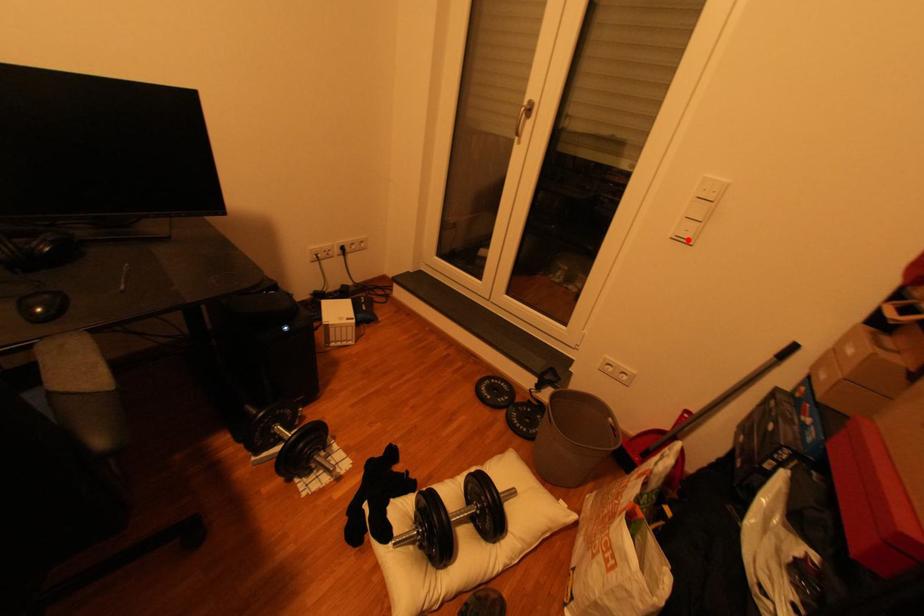
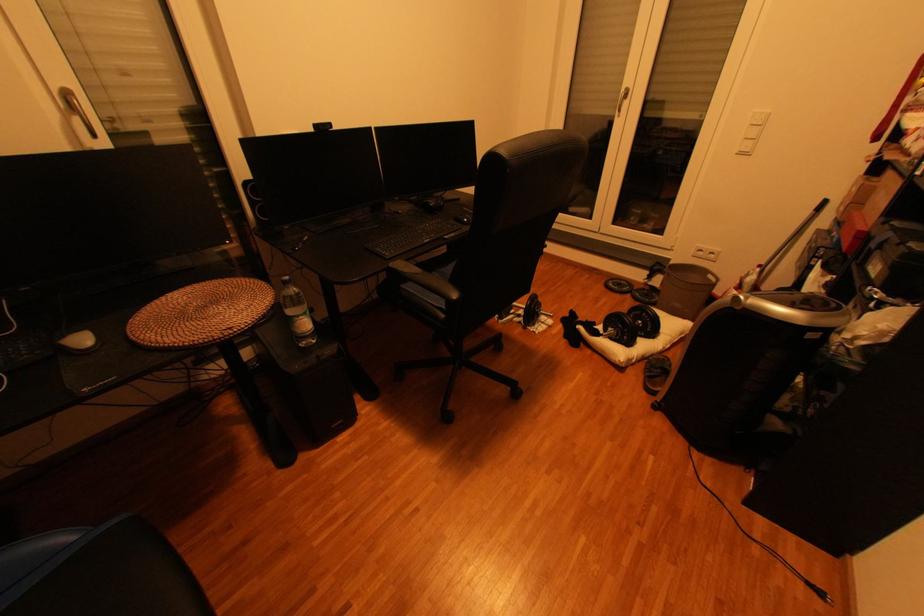
Question: I am providing you with two images of the same scene from different viewpoints. A red point is marked on the first image. Can you still see the location of the red point in image 2?

Choices:
 (A) Yes
 (B) No

Answer: (A)